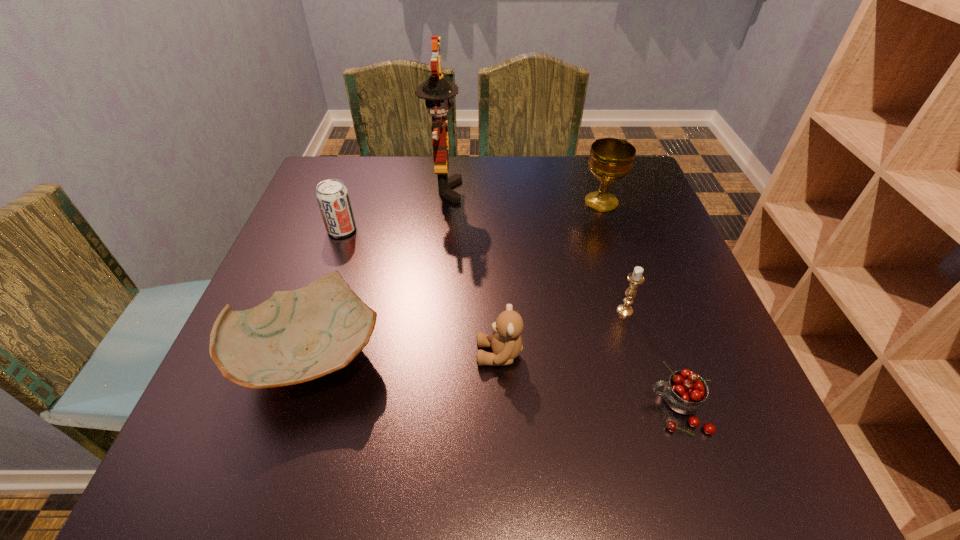
This screenshot has width=960, height=540. Find the location of `the tallest object`. the tallest object is located at coordinates (437, 91).

Find the location of a particular element. nutcracker is located at coordinates (437, 91).

The image size is (960, 540). I want to click on the second tallest object, so click(x=611, y=159).

Locate an element on the screen. the third farthest object is located at coordinates (333, 199).

The image size is (960, 540). In order to click on candle holder in this screenshot , I will do `click(635, 278)`.

You are a GUI agent. You are given a task and a screenshot of the screen. Output one action in this format:
    pyautogui.click(x=<x>, y=<y>)
    Task: Click on the fourth object from left to right
    
    Given the screenshot: What is the action you would take?
    pyautogui.click(x=506, y=344)

This screenshot has height=540, width=960. I want to click on pottery, so click(295, 336).

Where is `cherry`? The height and width of the screenshot is (540, 960). cherry is located at coordinates (685, 392).

Locate an element on the screen. vacant space located on the front-facing side of the nutcracker is located at coordinates [x=612, y=190].

I want to click on vacant space located on the back of the chalice, so click(x=594, y=180).